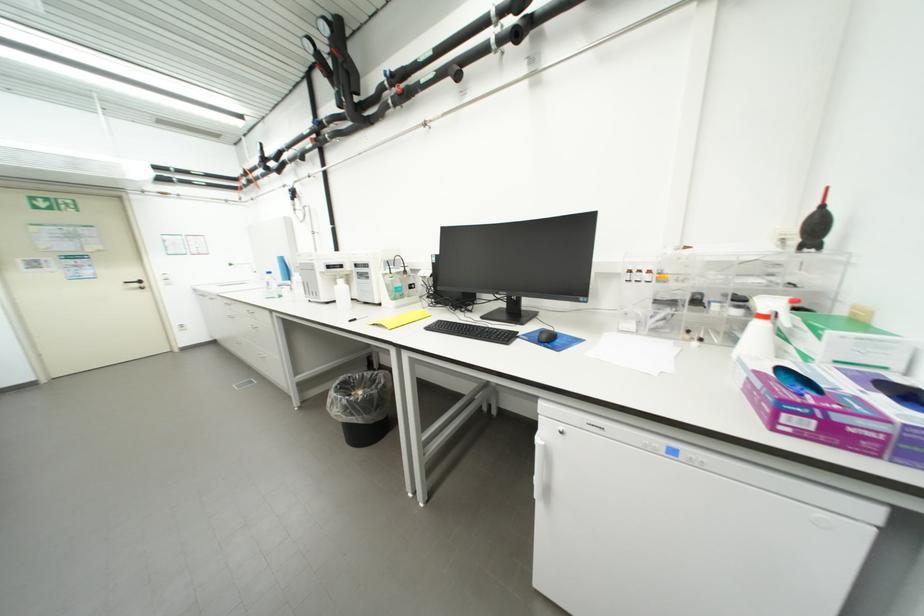
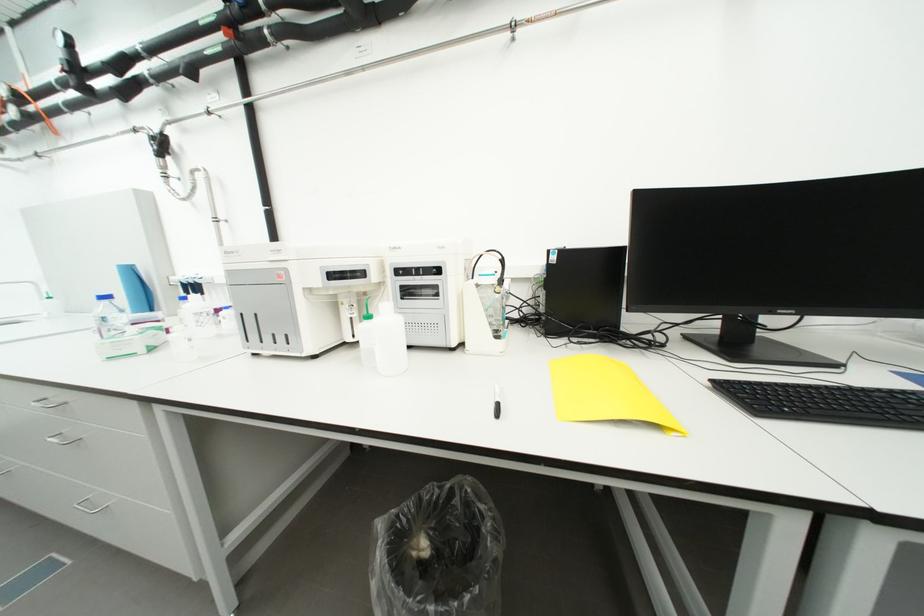
Find the pixel in the second image that matches (x=384, y=377) in the first image.

(459, 493)